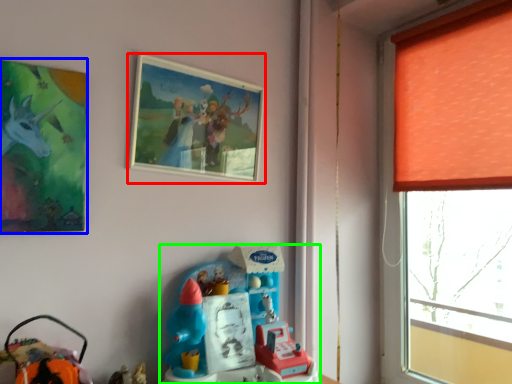
Question: Based on their relative distances, which object is farther from picture frame (highlighted by a red box)? Choose from picture frame (highlighted by a blue box) and toy (highlighted by a green box).

Choices:
 (A) picture frame
 (B) toy

Answer: (B)